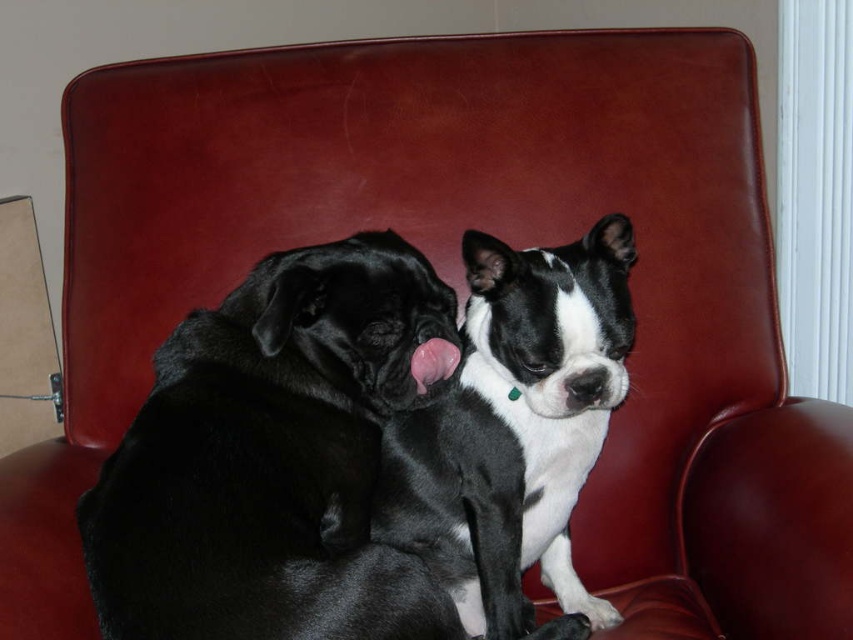
Between black fur dog at left and black glossy dog at center, which one has less height?

black fur dog at left is shorter.

Which is in front, point (318, 292) or point (426, 545)?

Point (318, 292)

Where is `black fur dog at left`? black fur dog at left is located at coordinates (274, 458).